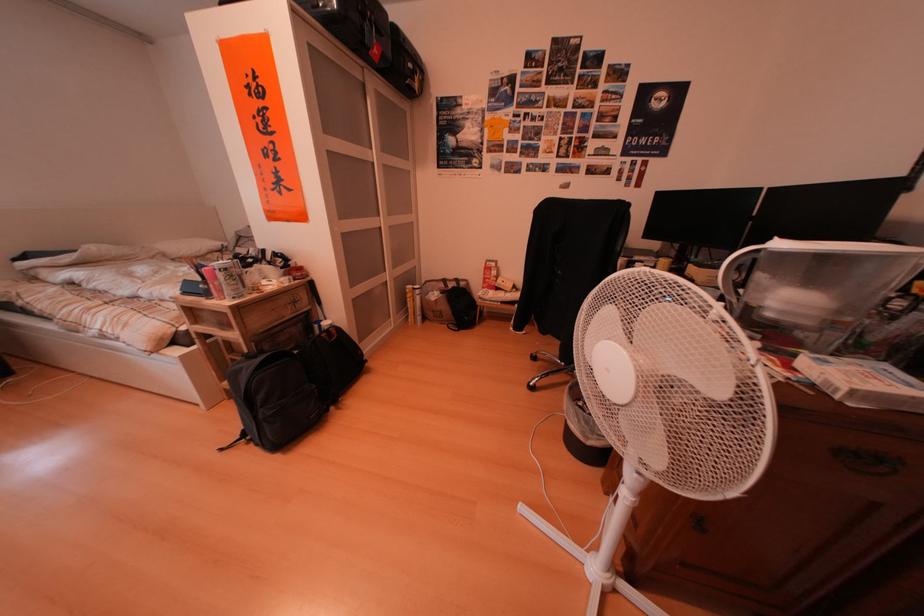
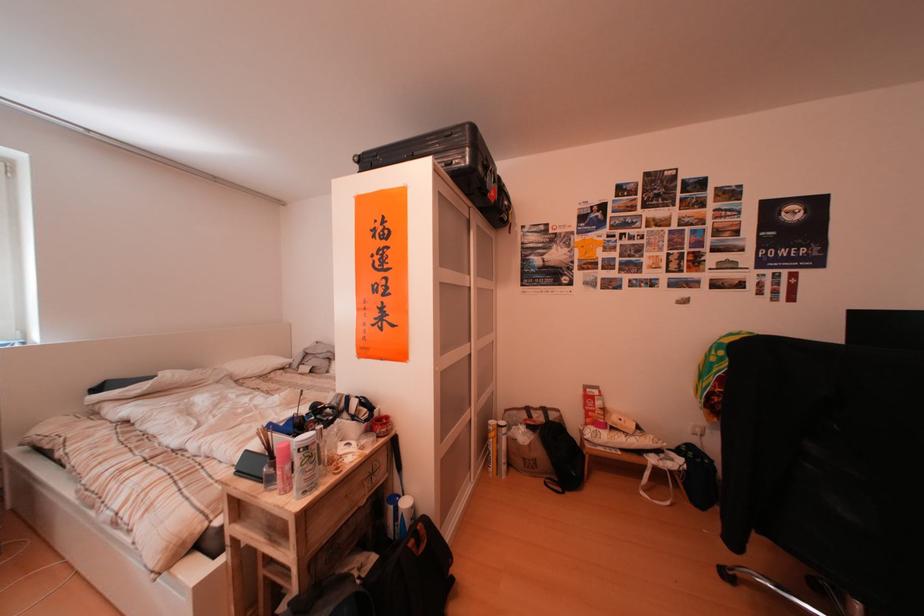
Find the pixel in the second image that matches pixel 298 280 in the first image.

(381, 436)